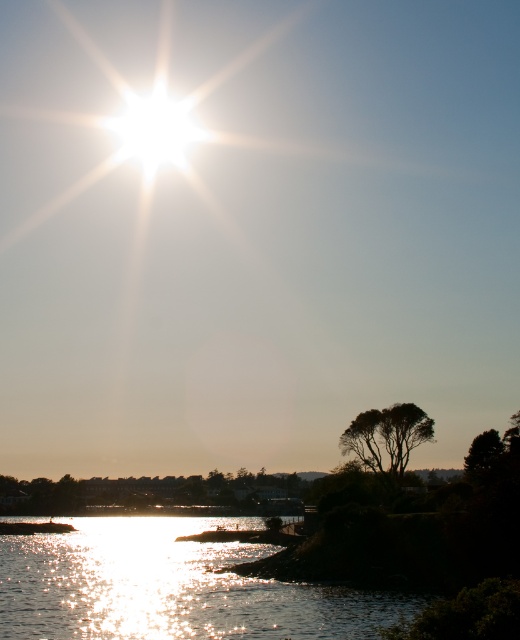
You are standing at the point marked by the coordinates point (171,586) in the image. What do you see directly below you?

You are standing directly above the shiny reflective water at lower center located at point (171,586).

You are standing at the lakeside and want to take a photo of both the shiny reflective water at lower center and the silhouette leafy tree at lower right. Which object should you focus on first to ensure both are in sharp focus?

You should focus on the silhouette leafy tree at lower right first because it is farther away from the viewer than the shiny reflective water at lower center. By focusing on the farther object, the near object will also be in focus due to the depth of field.